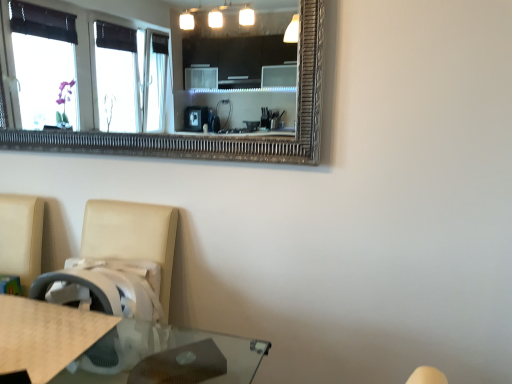
Locate an element on the screen. The image size is (512, 384). empty space that is ontop of beige textured mat at lower left (from a real-world perspective) is located at coordinates (36, 333).